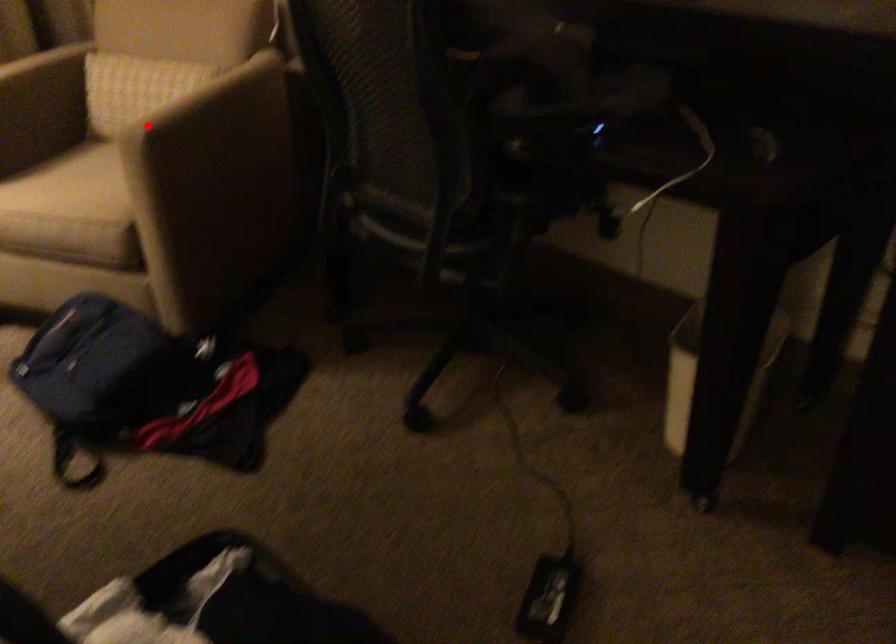
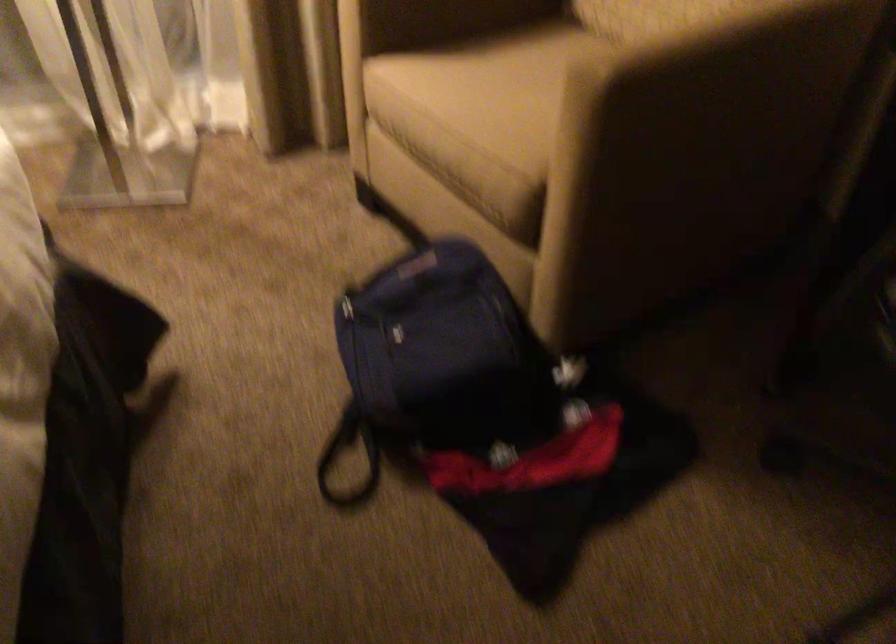
Find the pixel in the second image that matches the highlighted location in the first image.

(617, 53)